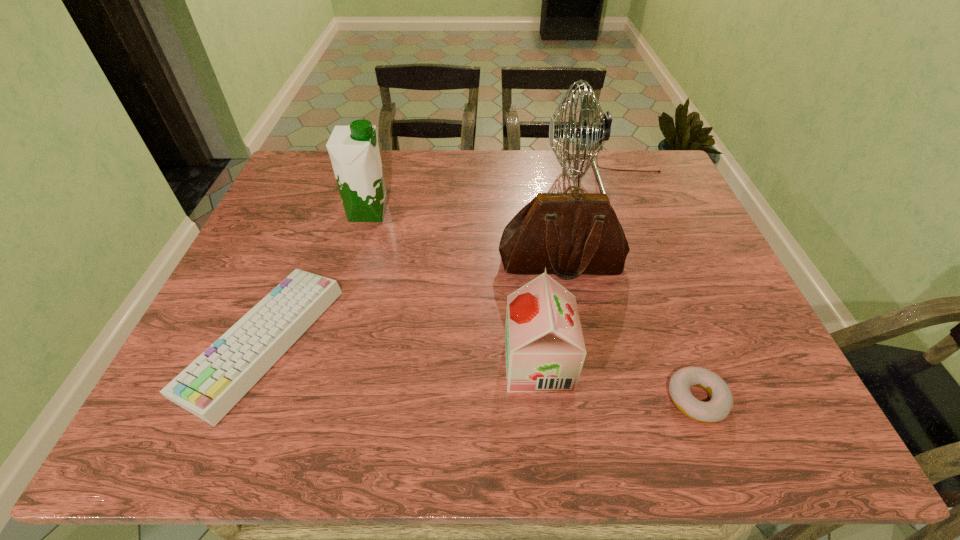
Where is `free location that satisfies the following two spatial constraints: 1. on the front side of the shortest object; 2. on the right side of the shoulder bag`? The image size is (960, 540). free location that satisfies the following two spatial constraints: 1. on the front side of the shortest object; 2. on the right side of the shoulder bag is located at coordinates (587, 399).

You are a GUI agent. You are given a task and a screenshot of the screen. Output one action in this format:
    pyautogui.click(x=<x>, y=<y>)
    Task: Click on the free region that satisfies the following two spatial constraints: 1. with the cap open on the shorter soya milk; 2. on the left side of the doughnut
    The height and width of the screenshot is (540, 960).
    Given the screenshot: What is the action you would take?
    pyautogui.click(x=542, y=399)

Find the location of a particular element. The width and height of the screenshot is (960, 540). vacant space that satisfies the following two spatial constraints: 1. on the back side of the shortest object; 2. on the front-facing side of the taller soya milk is located at coordinates [627, 212].

In order to click on blank space that satisfies the following two spatial constraints: 1. on the front side of the computer keyboard; 2. on the right side of the shortest object in this screenshot , I will do `click(239, 399)`.